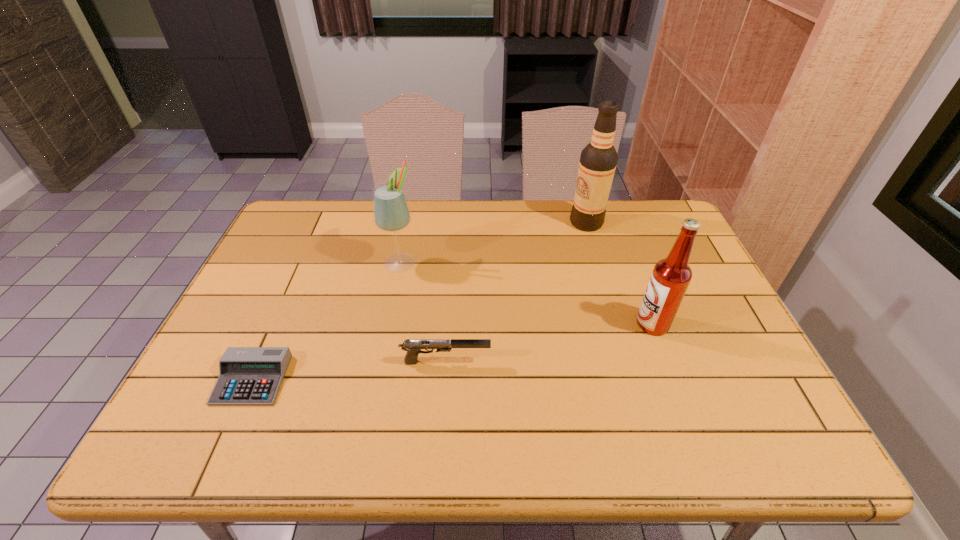
Locate an element on the screen. This screenshot has width=960, height=540. vacant space at the near edge of the desktop is located at coordinates (687, 441).

You are a GUI agent. You are given a task and a screenshot of the screen. Output one action in this format:
    pyautogui.click(x=<x>, y=<y>)
    Task: Click on the vacant space at the left edge
    This screenshot has width=960, height=540.
    Given the screenshot: What is the action you would take?
    pyautogui.click(x=238, y=329)

The image size is (960, 540). I want to click on free space at the right edge of the desktop, so click(701, 282).

Identify the location of vacant space at the far right corner of the desktop. The height and width of the screenshot is (540, 960). (660, 218).

The height and width of the screenshot is (540, 960). I want to click on vacant point located between the second shortest object and the second nearest alcohol, so click(423, 312).

Find the location of a particular element. The width and height of the screenshot is (960, 540). vacant area between the second farthest object and the nearest alcohol is located at coordinates (527, 293).

At what (x,y) coordinates should I click in order to perform the action: click on empty space that is in between the nearest alcohol and the second farthest alcohol. Please return your answer as a coordinate pair (x, y). Looking at the image, I should click on (527, 293).

Locate an element on the screen. The width and height of the screenshot is (960, 540). free space between the farthest object and the second farthest object is located at coordinates (493, 242).

This screenshot has height=540, width=960. In order to click on free spot between the fourth tallest object and the leftmost alcohol in this screenshot , I will do point(423,312).

What are the coordinates of `unoccupied position between the tallest alcohol and the leftmost object` in the screenshot? It's located at (420, 301).